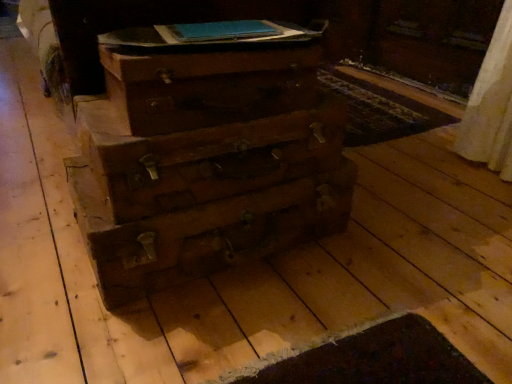
Image resolution: width=512 pixels, height=384 pixels. What do you see at coordinates (208, 83) in the screenshot?
I see `wooden drawer at center, the 1th drawer viewed from the top` at bounding box center [208, 83].

You are a GUI agent. You are given a task and a screenshot of the screen. Output one action in this format:
    pyautogui.click(x=<x>, y=<y>)
    Task: Click on the wooden drawer at center, the first drawer from the bottom
    This screenshot has height=384, width=512.
    Given the screenshot: What is the action you would take?
    pyautogui.click(x=220, y=166)

Where is `wooden chest of drawers at center`? Image resolution: width=512 pixels, height=384 pixels. wooden chest of drawers at center is located at coordinates (205, 158).

Find the location of a particular element. The height and width of the screenshot is (384, 512). blue paper book at upper center is located at coordinates (207, 34).

Identify the location of wooden drawer at center, which is counted as the 2th drawer, starting from the bottom. (208, 83).

Considering the positions of points (127, 217) and (222, 27), is point (127, 217) closer to camera compared to point (222, 27)?

Yes, point (127, 217) is closer to viewer.

Looking at the image, does wooden drawer at center, the first drawer from the bottom, seem bigger or smaller compared to blue paper book at upper center?

Clearly, wooden drawer at center, the first drawer from the bottom, is larger in size than blue paper book at upper center.

Image resolution: width=512 pixels, height=384 pixels. There is a wooden drawer at center, which appears as the second drawer when viewed from the top. In order to click on book above it (from a real-world perspective) in this screenshot , I will do `click(207, 34)`.

Are wooden drawer at center, which appears as the second drawer when viewed from the top, and blue paper book at upper center located far from each other?

No, there isn't a large distance between wooden drawer at center, which appears as the second drawer when viewed from the top, and blue paper book at upper center.

Are wooden drawer at center, the 1th drawer viewed from the top, and blue paper book at upper center making contact?

No.

Considering the relative positions of wooden drawer at center, the 1th drawer viewed from the top, and blue paper book at upper center in the image provided, is wooden drawer at center, the 1th drawer viewed from the top, in front of blue paper book at upper center?

Yes, wooden drawer at center, the 1th drawer viewed from the top, is in front of blue paper book at upper center.

Measure the distance between wooden drawer at center, the 1th drawer viewed from the top, and blue paper book at upper center.

wooden drawer at center, the 1th drawer viewed from the top, is 4.02 inches away from blue paper book at upper center.

Considering the relative sizes of wooden drawer at center, which is counted as the 2th drawer, starting from the bottom, and blue paper book at upper center in the image provided, is wooden drawer at center, which is counted as the 2th drawer, starting from the bottom, smaller than blue paper book at upper center?

Actually, wooden drawer at center, which is counted as the 2th drawer, starting from the bottom, might be larger than blue paper book at upper center.

Based on the photo, is blue paper book at upper center placed right next to wooden drawer at center, the 1th drawer viewed from the top?

They are not placed beside each other.

Could you measure the distance between blue paper book at upper center and wooden drawer at center, which is counted as the 2th drawer, starting from the bottom?

blue paper book at upper center and wooden drawer at center, which is counted as the 2th drawer, starting from the bottom, are 10.22 centimeters apart from each other.

Is blue paper book at upper center bigger or smaller than wooden drawer at center, which is counted as the 2th drawer, starting from the bottom?

blue paper book at upper center is smaller than wooden drawer at center, which is counted as the 2th drawer, starting from the bottom.

From a real-world perspective, which drawer is the 1st one underneath the blue paper book at upper center? Please provide its 2D coordinates.

[(208, 83)]

Measure the distance between wooden drawer at center, which is counted as the 2th drawer, starting from the bottom, and wooden drawer at center, the first drawer from the bottom.

wooden drawer at center, which is counted as the 2th drawer, starting from the bottom, and wooden drawer at center, the first drawer from the bottom, are 4.21 inches apart from each other.

Is wooden drawer at center, the 1th drawer viewed from the top, at the right side of wooden drawer at center, the first drawer from the bottom?

Yes.

Is point (139, 101) positioned before point (179, 162)?

Yes, point (139, 101) is in front of point (179, 162).

Does wooden drawer at center, the 1th drawer viewed from the top, have a lesser height compared to wooden drawer at center, which appears as the second drawer when viewed from the top?

Yes, wooden drawer at center, the 1th drawer viewed from the top, is shorter than wooden drawer at center, which appears as the second drawer when viewed from the top.

Where is `the chest of drawers below the wooden drawer at center, the first drawer from the bottom (from the image's perspective)`? The width and height of the screenshot is (512, 384). the chest of drawers below the wooden drawer at center, the first drawer from the bottom (from the image's perspective) is located at coordinates (205, 158).

How different are the orientations of wooden drawer at center, the first drawer from the bottom, and wooden chest of drawers at center in degrees?

The facing directions of wooden drawer at center, the first drawer from the bottom, and wooden chest of drawers at center are 3.03 degrees apart.

Can you confirm if wooden drawer at center, the first drawer from the bottom, is thinner than wooden chest of drawers at center?

Yes.

Is point (176, 180) more distant than point (129, 73)?

Yes, it is behind point (129, 73).

Can you confirm if wooden chest of drawers at center is shorter than wooden drawer at center, the 1th drawer viewed from the top?

No.

Considering the positions of points (274, 162) and (147, 65), is point (274, 162) farther from camera compared to point (147, 65)?

Yes, it is behind point (147, 65).

Is wooden chest of drawers at center positioned far away from wooden drawer at center, which is counted as the 2th drawer, starting from the bottom?

That's not correct — wooden chest of drawers at center is a little close to wooden drawer at center, which is counted as the 2th drawer, starting from the bottom.

Is wooden chest of drawers at center at the right side of wooden drawer at center, the 1th drawer viewed from the top?

Incorrect, wooden chest of drawers at center is not on the right side of wooden drawer at center, the 1th drawer viewed from the top.

Between wooden chest of drawers at center and wooden drawer at center, which appears as the second drawer when viewed from the top, which one appears on the left side from the viewer's perspective?

Positioned to the left is wooden drawer at center, which appears as the second drawer when viewed from the top.

Does wooden chest of drawers at center turn towards wooden drawer at center, the first drawer from the bottom?

No, wooden chest of drawers at center is not aimed at wooden drawer at center, the first drawer from the bottom.

From the image's perspective, who appears lower, wooden chest of drawers at center or wooden drawer at center, the first drawer from the bottom?

wooden chest of drawers at center is shown below in the image.

From a real-world perspective, which object stands above the other?

wooden drawer at center, the first drawer from the bottom, is physically above.

Where is `book located above the wooden drawer at center, the first drawer from the bottom (from a real-world perspective)`? This screenshot has width=512, height=384. book located above the wooden drawer at center, the first drawer from the bottom (from a real-world perspective) is located at coordinates (207, 34).

From a real-world perspective, count 1st drawers downward from the blue paper book at upper center and point to it. Please provide its 2D coordinates.

[(208, 83)]

From the image, which object appears to be farther from wooden drawer at center, which appears as the second drawer when viewed from the top, wooden drawer at center, which is counted as the 2th drawer, starting from the bottom, or blue paper book at upper center?

Based on the image, blue paper book at upper center appears to be further to wooden drawer at center, which appears as the second drawer when viewed from the top.

Looking at this image, looking at the image, which one is located closer to wooden chest of drawers at center, blue paper book at upper center or wooden drawer at center, which appears as the second drawer when viewed from the top?

wooden drawer at center, which appears as the second drawer when viewed from the top.

In the scene shown: Considering their positions, is wooden drawer at center, the first drawer from the bottom, positioned closer to blue paper book at upper center than wooden drawer at center, which is counted as the 2th drawer, starting from the bottom?

wooden drawer at center, which is counted as the 2th drawer, starting from the bottom, is positioned closer to the anchor blue paper book at upper center.

Which object lies further to the anchor point wooden chest of drawers at center, wooden drawer at center, the 1th drawer viewed from the top, or blue paper book at upper center?

blue paper book at upper center lies further to wooden chest of drawers at center than the other object.

Looking at the image, which one is located further to wooden drawer at center, the first drawer from the bottom, blue paper book at upper center or wooden drawer at center, which is counted as the 2th drawer, starting from the bottom?

blue paper book at upper center lies further to wooden drawer at center, the first drawer from the bottom, than the other object.

Looking at the image, which one is located further to wooden drawer at center, which appears as the second drawer when viewed from the top, blue paper book at upper center or wooden chest of drawers at center?

blue paper book at upper center is positioned further to the anchor wooden drawer at center, which appears as the second drawer when viewed from the top.

Looking at this image, when comparing their distances from wooden drawer at center, the 1th drawer viewed from the top, does wooden chest of drawers at center or wooden drawer at center, the first drawer from the bottom, seem further?

The object further to wooden drawer at center, the 1th drawer viewed from the top, is wooden drawer at center, the first drawer from the bottom.

Which object lies nearer to the anchor point wooden drawer at center, which appears as the second drawer when viewed from the top, wooden chest of drawers at center or wooden drawer at center, which is counted as the 2th drawer, starting from the bottom?

The object closer to wooden drawer at center, which appears as the second drawer when viewed from the top, is wooden chest of drawers at center.

Find the location of a particular element. drawer between blue paper book at upper center and wooden drawer at center, which appears as the second drawer when viewed from the top, in the vertical direction is located at coordinates (208, 83).

Identify the location of drawer between wooden drawer at center, which is counted as the 2th drawer, starting from the bottom, and wooden chest of drawers at center, in the vertical direction. (220, 166).